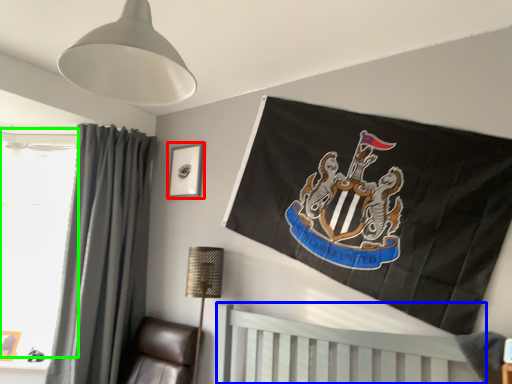
Question: Which object is positioned farthest from picture frame (highlighted by a red box)? Select from furniture (highlighted by a blue box) and window screen (highlighted by a green box).

Choices:
 (A) furniture
 (B) window screen

Answer: (A)